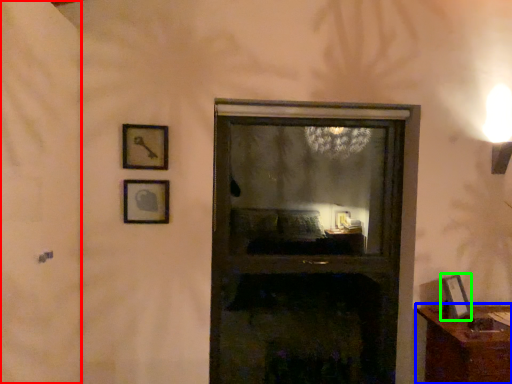
Question: Estimate the real-world distances between objects in this image. Which object is farther from screen door (highlighted by a red box), furniture (highlighted by a blue box) or picture frame (highlighted by a green box)?

Choices:
 (A) furniture
 (B) picture frame

Answer: (B)